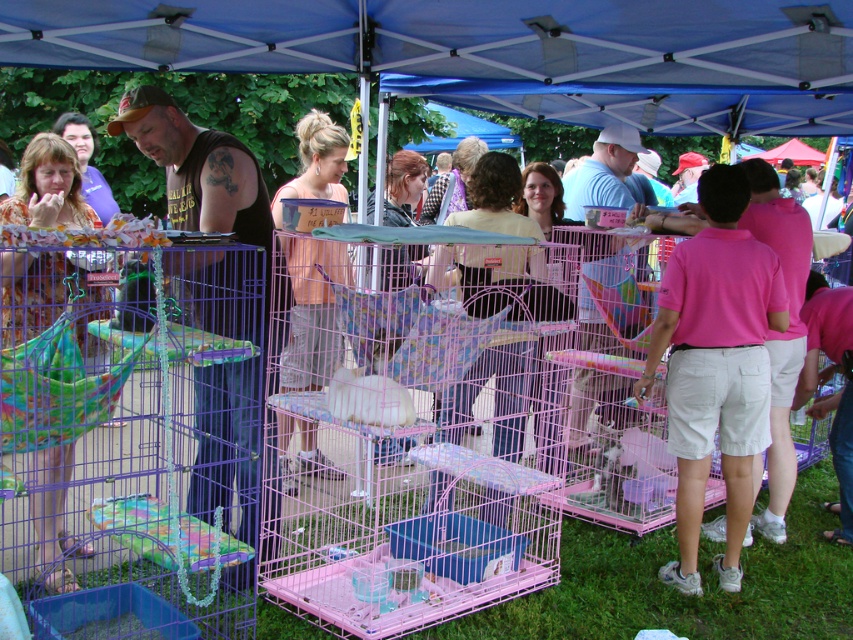
You are a photographer standing at the entrance of the market. You want to take a photo that includes both the point at (x=167, y=204) and the point at (x=42, y=516). Which point should you focus on first to ensure both are in sharp focus?

You should focus on the point at (x=167, y=204) first because it is closer to the camera than the point at (x=42, y=516). By focusing on the closer point, the farther point will also be within the depth of field and in focus.

You are a fashion designer attending the pet adoption event and notice two dresses displayed nearby. Which dress has a shorter length between the floral dress at left and the pink fabric dress at center?

The floral dress at left is shorter than the pink fabric dress at center, so the floral dress at left has the shorter length.